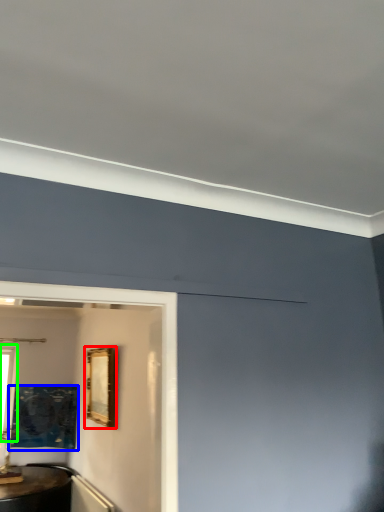
Question: Estimate the real-world distances between objects in this image. Which object is closer to picture frame (highlighted by a red box), picture frame (highlighted by a blue box) or window (highlighted by a green box)?

Choices:
 (A) picture frame
 (B) window

Answer: (A)